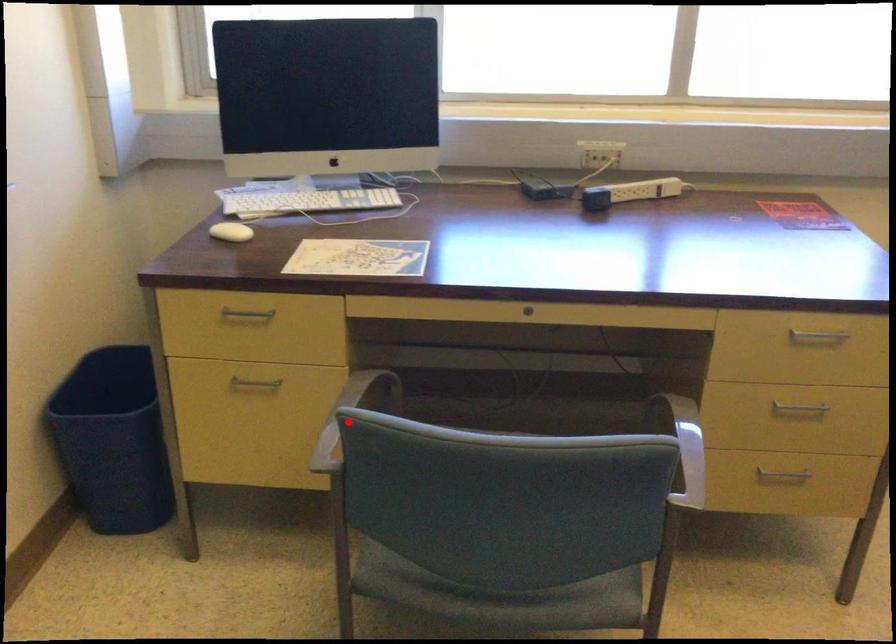
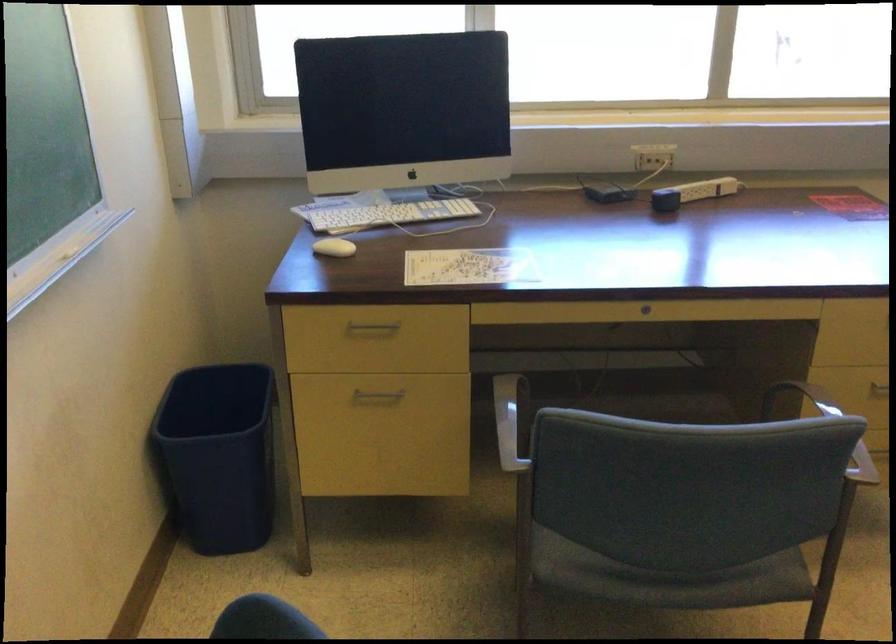
Locate, in the second image, the point that corresponds to the highlighted location in the first image.

(511, 421)